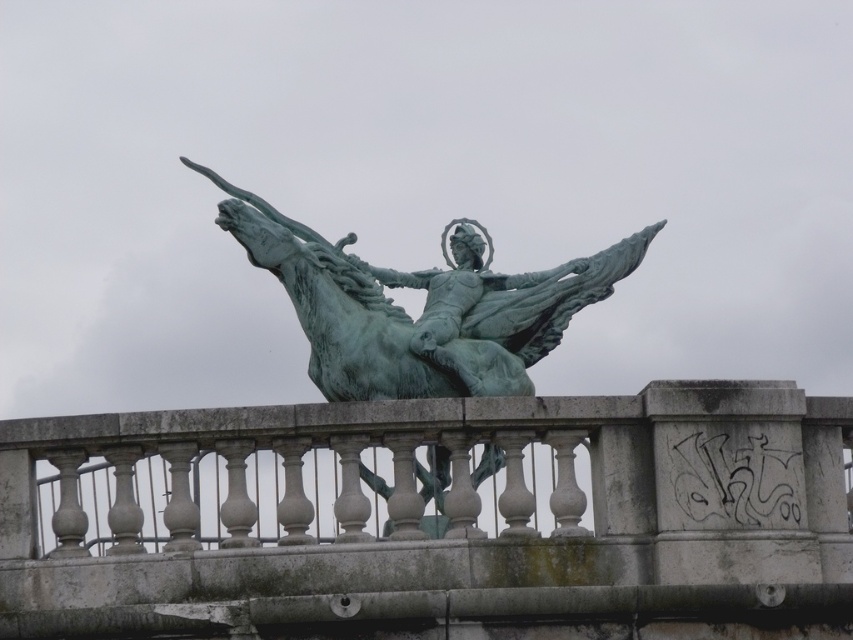
Question: Observing the image, what is the correct spatial positioning of green stone railing at center in reference to green patina statue at center?

Choices:
 (A) above
 (B) below

Answer: (B)

Question: Does green stone railing at center appear under green patina statue at center?

Choices:
 (A) yes
 (B) no

Answer: (A)

Question: Does green stone railing at center have a lesser width compared to green patina statue at center?

Choices:
 (A) no
 (B) yes

Answer: (A)

Question: Which of the following is the closest to the observer?

Choices:
 (A) green stone railing at center
 (B) green patina statue at center

Answer: (A)

Question: Among these objects, which one is farthest from the camera?

Choices:
 (A) green stone railing at center
 (B) green patina statue at center

Answer: (B)